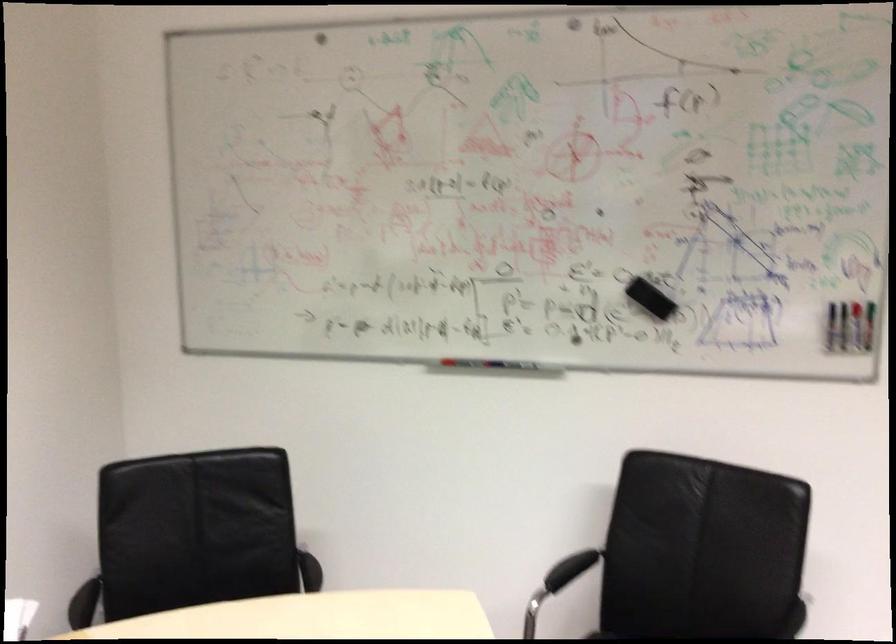
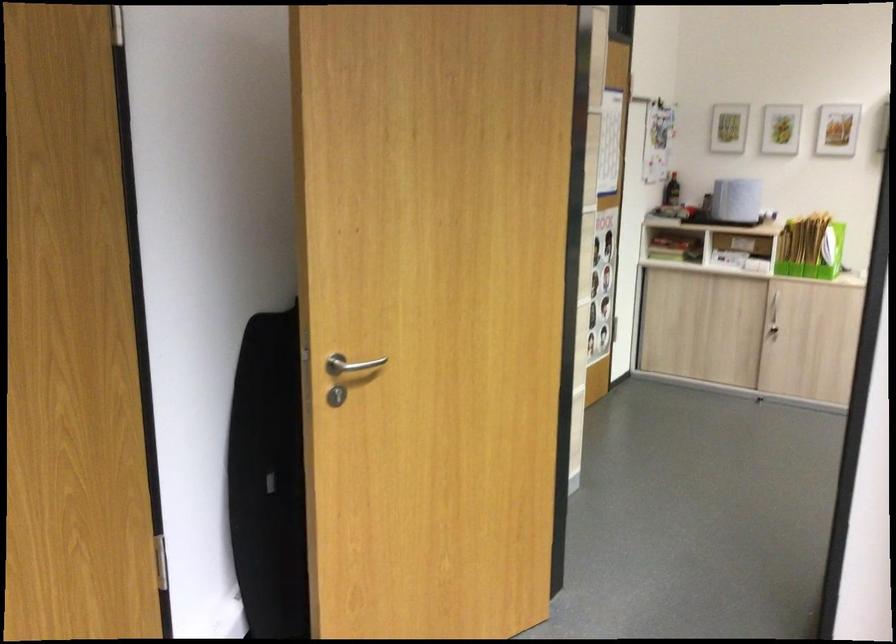
Question: Based on the continuous images, in which direction is the camera rotating? Reply with the corresponding letter.

Choices:
 (A) Left
 (B) Right
 (C) Up
 (D) Down

Answer: (B)